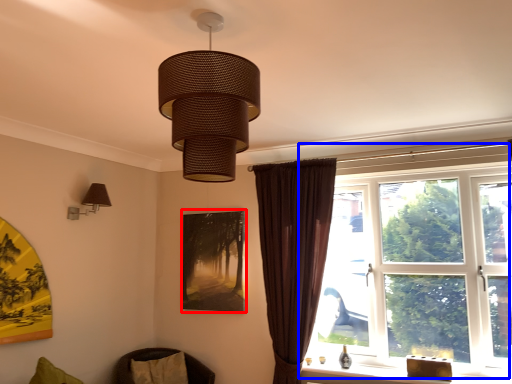
Question: Among these objects, which one is nearest to the camera, picture frame (highlighted by a red box) or window (highlighted by a blue box)?

Choices:
 (A) picture frame
 (B) window

Answer: (B)